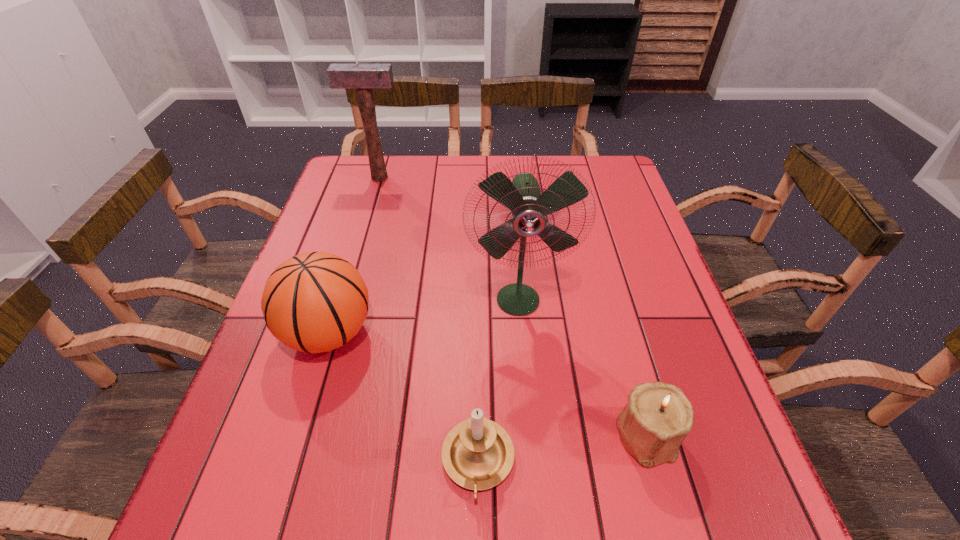
You are a GUI agent. You are given a task and a screenshot of the screen. Output one action in this format:
    pyautogui.click(x=<x>, y=<y>)
    Task: Click on the fan
    Image resolution: width=960 pixels, height=540 pixels.
    Given the screenshot: What is the action you would take?
    pyautogui.click(x=529, y=208)

The image size is (960, 540). Identify the location of mallet. (363, 77).

The width and height of the screenshot is (960, 540). What are the coordinates of `the farthest object` in the screenshot? It's located at (363, 77).

Locate an element on the screen. The width and height of the screenshot is (960, 540). the third shortest object is located at coordinates (314, 302).

The height and width of the screenshot is (540, 960). Identify the location of the left candle_holder. (477, 454).

I want to click on the right candle_holder, so click(x=658, y=418).

I want to click on blank space located on the front-facing side of the fan, so click(x=527, y=408).

At what (x,y) coordinates should I click in order to perform the action: click on vacant space situated 0.390m on the front of the farthest object. Please return your answer as a coordinate pair (x, y). The width and height of the screenshot is (960, 540). Looking at the image, I should click on (x=352, y=271).

Locate an element on the screen. This screenshot has width=960, height=540. vacant space located 0.350m on the back of the third tallest object is located at coordinates (367, 208).

The height and width of the screenshot is (540, 960). I want to click on vacant space located 0.070m on the left of the rightmost object, so click(576, 435).